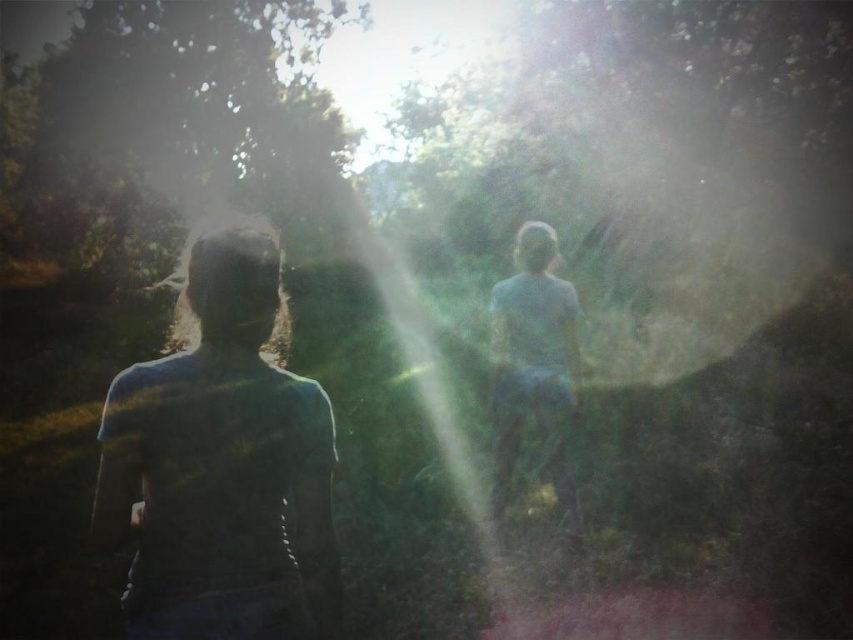
Question: Does matte blue shirt at left have a greater width compared to light blue fabric at center?

Choices:
 (A) no
 (B) yes

Answer: (B)

Question: Is matte blue shirt at left closer to camera compared to light blue fabric at center?

Choices:
 (A) no
 (B) yes

Answer: (B)

Question: Which of the following is the closest to the observer?

Choices:
 (A) (546, 410)
 (B) (252, 256)

Answer: (B)

Question: Is matte blue shirt at left wider than light blue fabric at center?

Choices:
 (A) yes
 (B) no

Answer: (A)